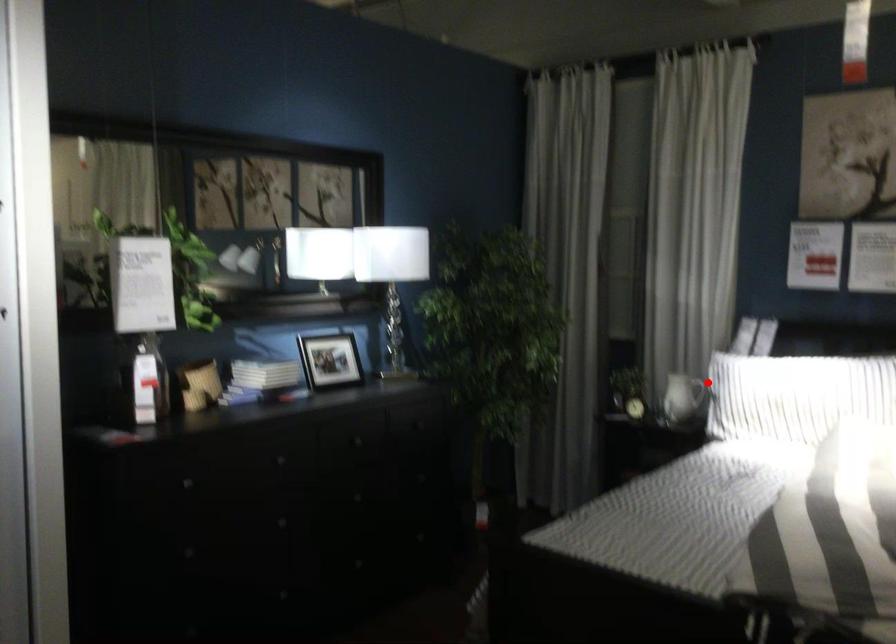
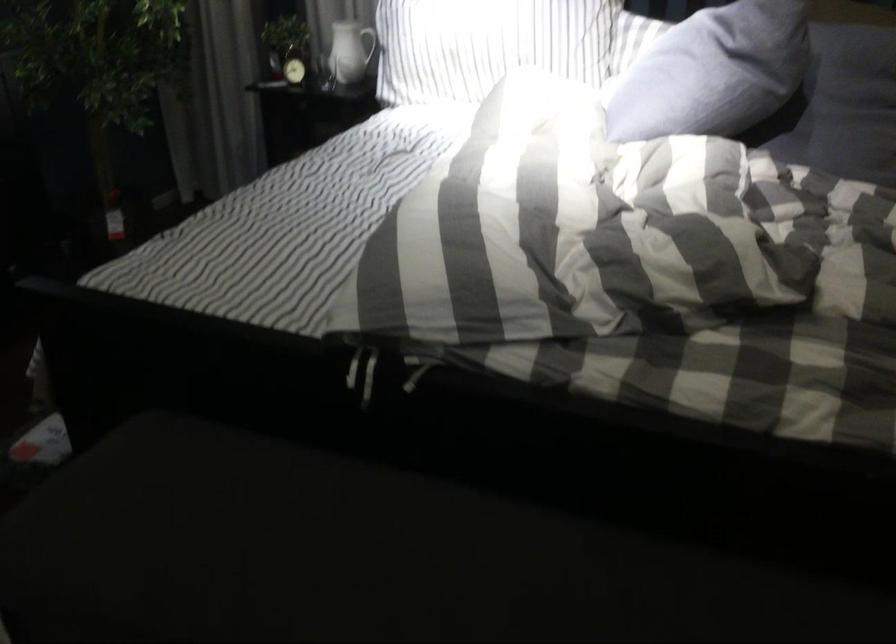
Question: I am providing you with two images of the same scene from different viewpoints. In image1, a red point is highlighted. Considering the same 3D point in image2, which of the following is correct?

Choices:
 (A) It is closer
 (B) It is farther

Answer: (A)